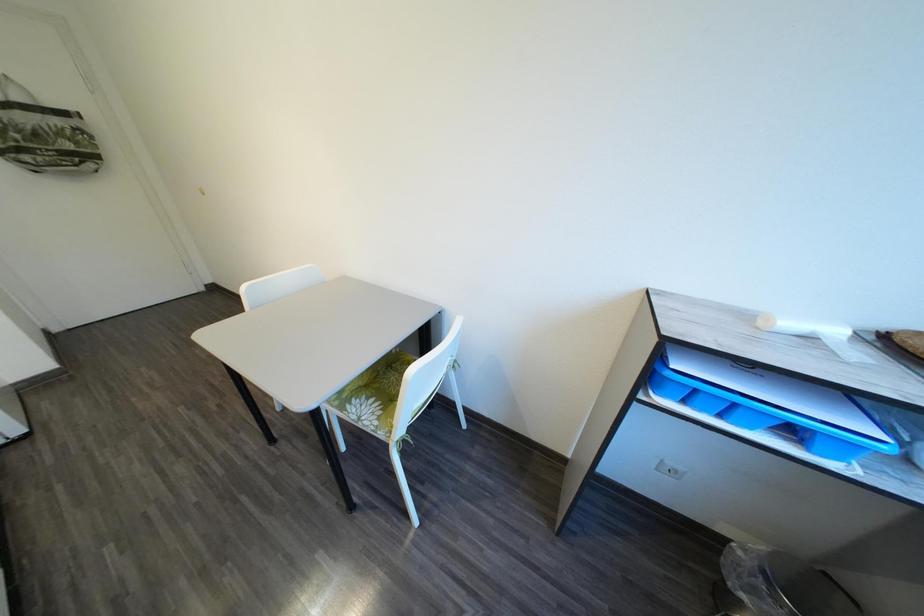
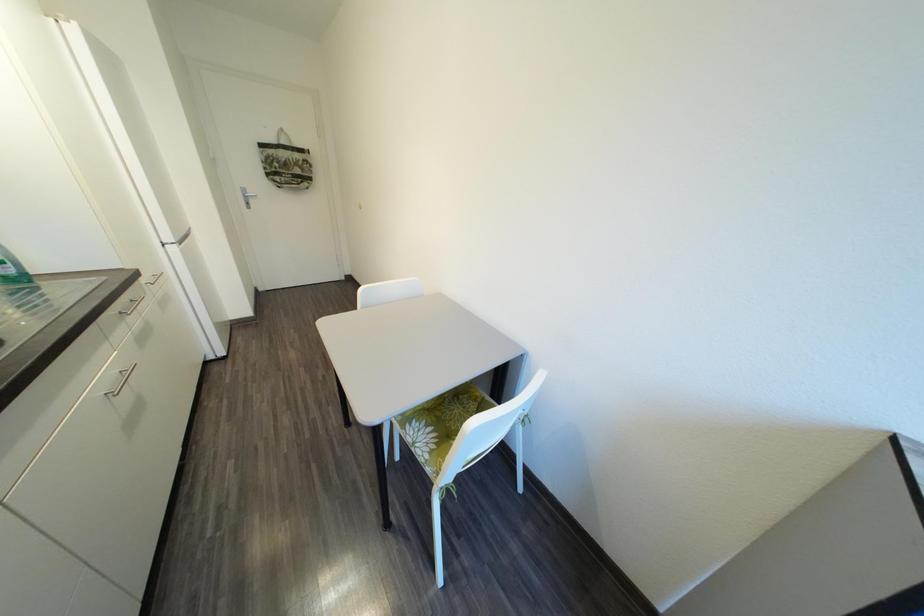
Question: The images are taken continuously from a first-person perspective. In which direction are you moving?

Choices:
 (A) Left
 (B) Right
 (C) Forward
 (D) Backward

Answer: (C)